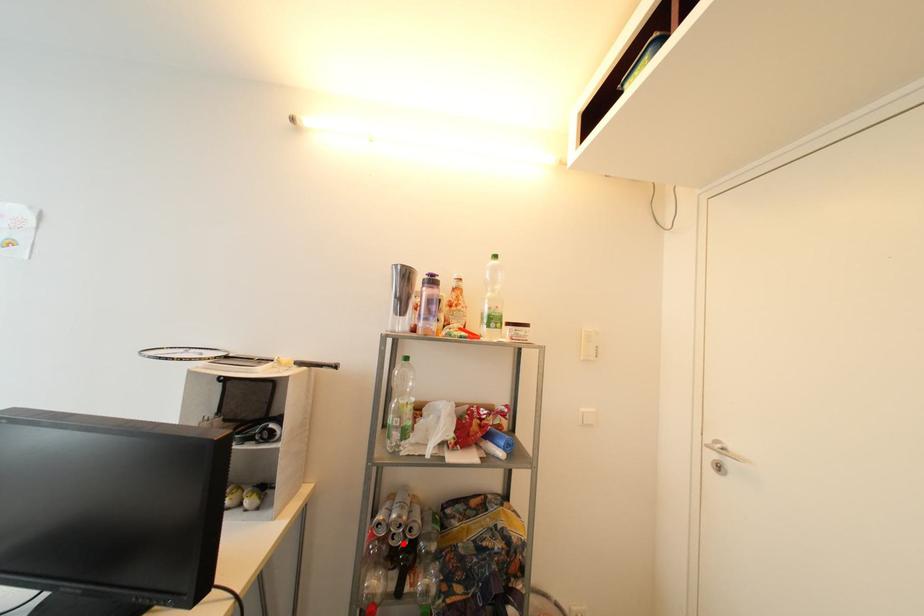
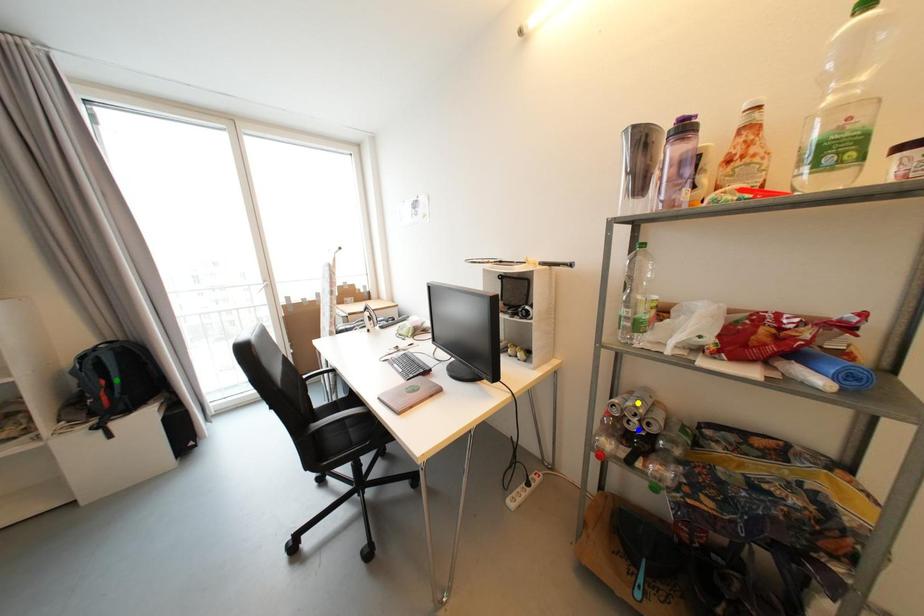
Question: I am providing you with two images of the same scene from different viewpoints. A red point is marked on the first image. You are given multiple points on the second image. Which mark in image 2 goes with the point in image 1?

Choices:
 (A) yellow point
 (B) green point
 (C) blue point

Answer: (C)